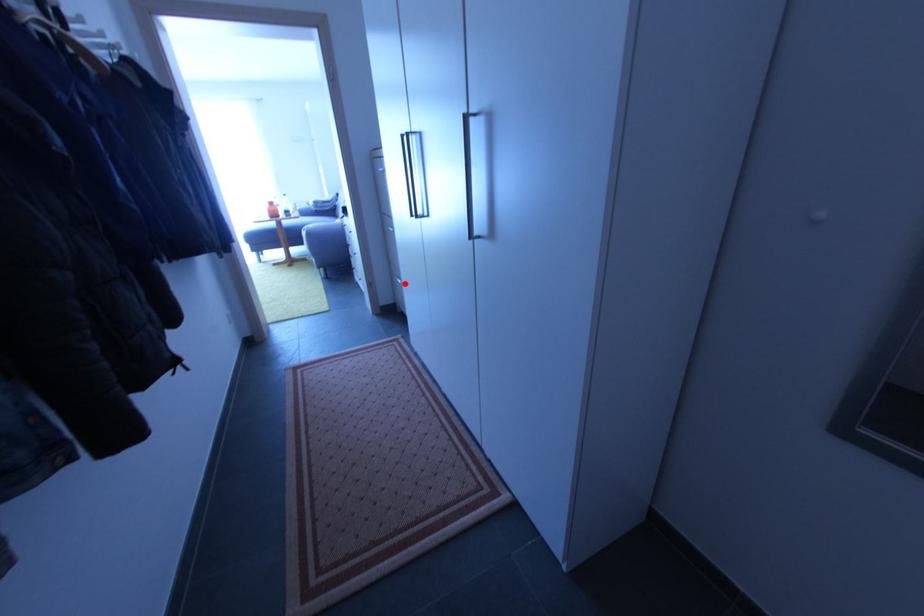
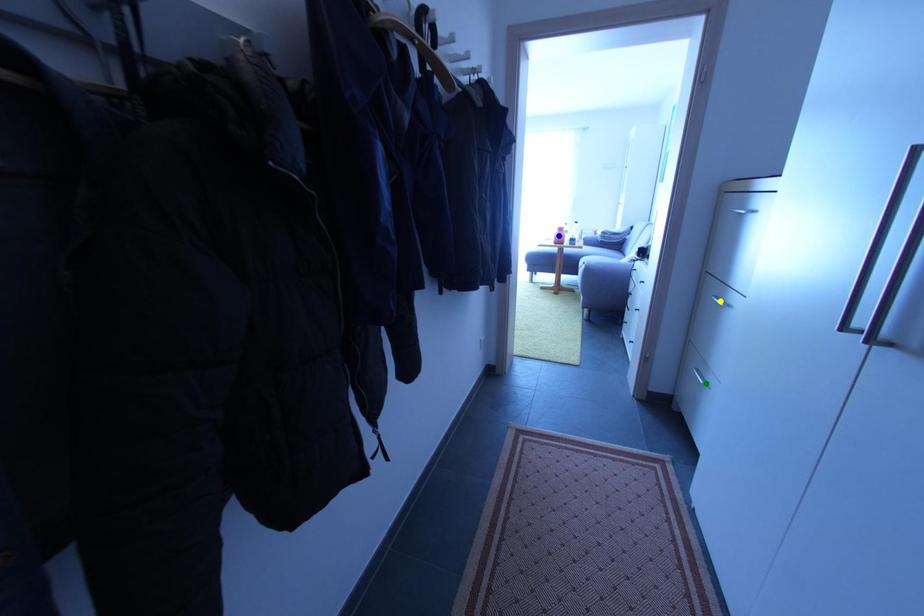
Question: I am providing you with two images of the same scene from different viewpoints. A red point is marked on the first image. You are given multiple points on the second image. Can you choose the point in image 2 that corresponds to the point in image 1?

Choices:
 (A) green point
 (B) blue point
 (C) yellow point

Answer: (A)